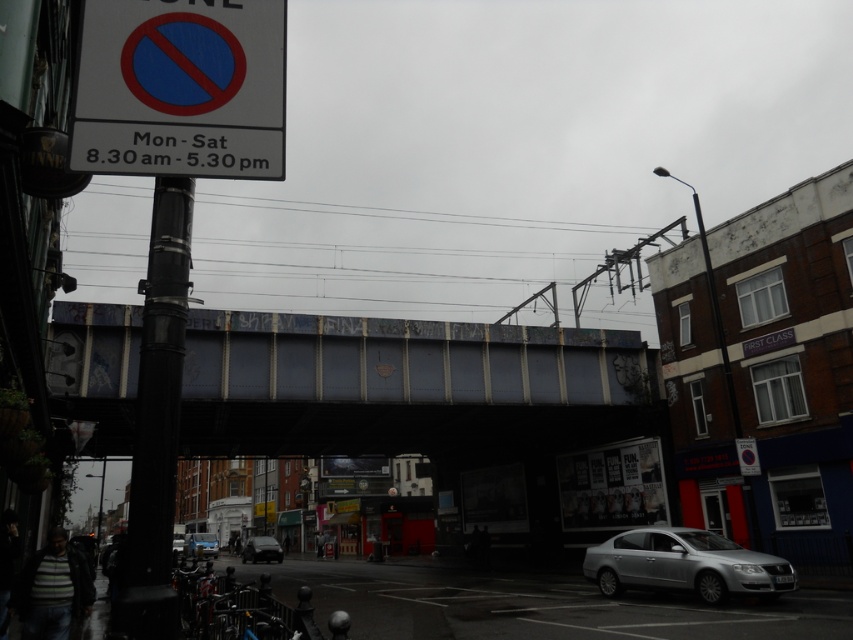
Who is more forward, (160, 90) or (674, 532)?

Point (160, 90) is more forward.

At what (x,y) coordinates should I click in order to perform the action: click on white plastic sign at upper left. Please return your answer as a coordinate pair (x, y). The image size is (853, 640). Looking at the image, I should click on (181, 88).

Which of these two, rusty metal bridge at center or silver metallic sedan at lower right, stands shorter?

silver metallic sedan at lower right

In the scene shown: Who is positioned more to the right, rusty metal bridge at center or silver metallic sedan at lower right?

silver metallic sedan at lower right is more to the right.

Locate an element on the screen. The height and width of the screenshot is (640, 853). rusty metal bridge at center is located at coordinates pos(407,385).

This screenshot has height=640, width=853. What are the coordinates of `rusty metal bridge at center` in the screenshot? It's located at (407, 385).

Does point (277, 381) lie in front of point (178, 532)?

Yes.

Which is behind, point (283, 333) or point (173, 552)?

Positioned behind is point (173, 552).

Measure the distance between rusty metal bridge at center and camera.

A distance of 5.65 meters exists between rusty metal bridge at center and camera.

At what (x,y) coordinates should I click in order to perform the action: click on rusty metal bridge at center. Please return your answer as a coordinate pair (x, y). This screenshot has height=640, width=853. Looking at the image, I should click on (407, 385).